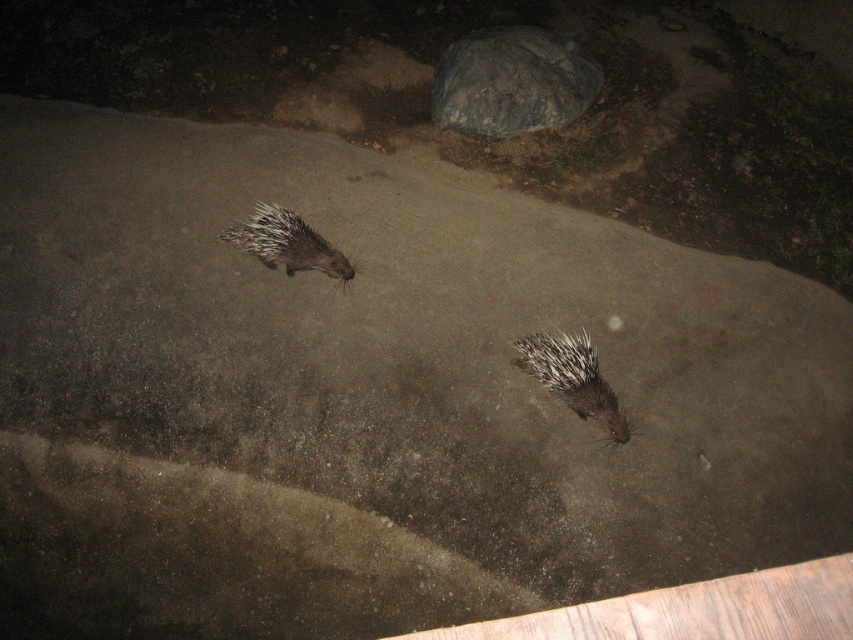
You are a photographer trying to capture the spiky brown hedgehog at lower center in your shot. The gray rough rock at upper center is blocking your view. Can you move the rock to get a clear shot of the hedgehog?

The spiky brown hedgehog at lower center is behind the gray rough rock at upper center, so moving the rock would allow you to see the hedgehog clearly.

You are a photographer trying to capture the spiky brown hedgehog at lower center in the center of your camera frame. Given its current 2D location coordinates, what adjustment should you make to the camera position to center the hedgehog?

To center the spiky brown hedgehog at lower center, move the camera upwards since its current position at point (572, 378) is below the center of the frame. The center of the frame is at coordinates around (426, 320), so moving the camera upward will bring the hedgehog closer to the center.

You are a photographer trying to capture a clear photo of the spiky brown hedgehog at lower center and the brown spiny hedgehog at center. Since the lighting is dim, you need to adjust your camera settings. Which hedgehog will appear brighter in the photo if you focus on the one closer to the camera?

The spiky brown hedgehog at lower center will appear brighter because it is closer to the camera and in front of the brown spiny hedgehog at center, so it will receive more light from the artificial source.